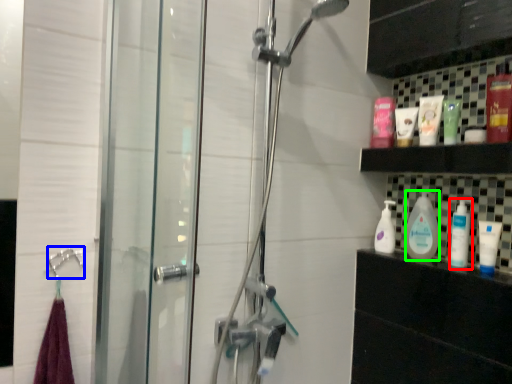
Question: Based on their relative distances, which object is farther from cleaning product (highlighted by a red box)? Choose from shower (highlighted by a blue box) and cleaning product (highlighted by a green box).

Choices:
 (A) shower
 (B) cleaning product

Answer: (A)